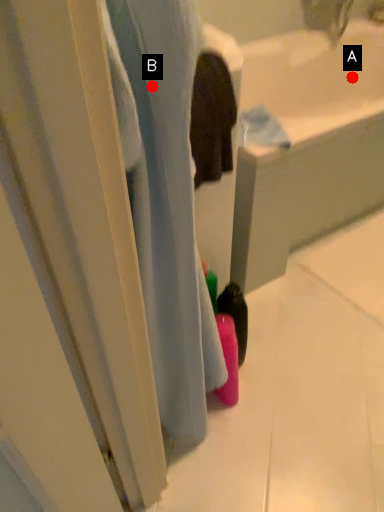
Question: Two points are circled on the image, labeled by A and B beside each circle. Which point appears farthest from the camera in this image?

Choices:
 (A) A is further
 (B) B is further

Answer: (A)